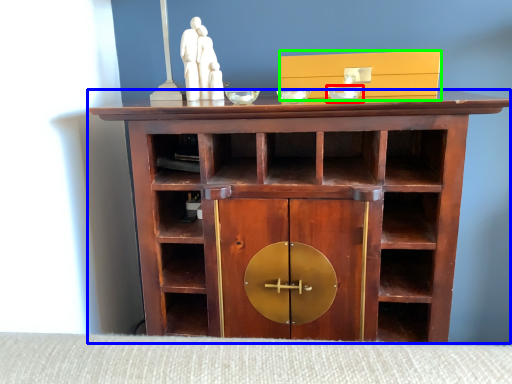
Question: Which object is positioned closest to glass bowl (highlighted by a red box)? Select from shelf (highlighted by a blue box) and cabinetry (highlighted by a green box).

Choices:
 (A) shelf
 (B) cabinetry

Answer: (B)